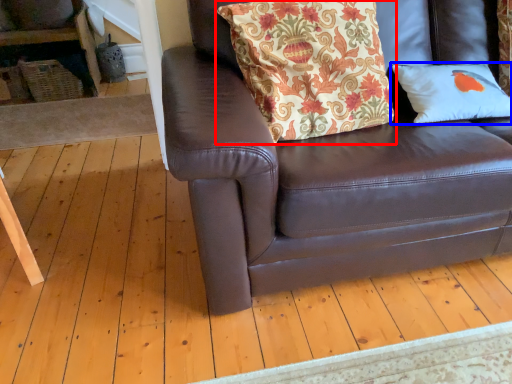
Question: Which object is further to the camera taking this photo, pillow (highlighted by a red box) or pillow (highlighted by a blue box)?

Choices:
 (A) pillow
 (B) pillow

Answer: (B)